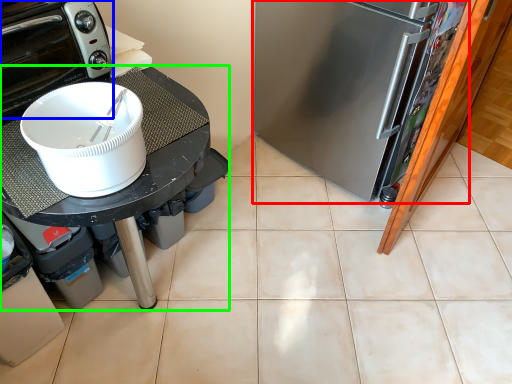
Question: Based on their relative distances, which object is farther from refrigerator (highlighted by a red box)? Choose from home appliance (highlighted by a blue box) and table (highlighted by a green box).

Choices:
 (A) home appliance
 (B) table

Answer: (A)